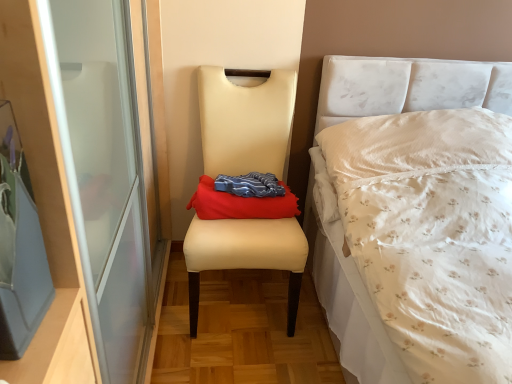
Question: From the image's perspective, is beige leather chair at center positioned above or below red fabric throw pillow at center?

Choices:
 (A) below
 (B) above

Answer: (A)

Question: Considering the positions of beige leather chair at center and red fabric throw pillow at center in the image, is beige leather chair at center bigger or smaller than red fabric throw pillow at center?

Choices:
 (A) small
 (B) big

Answer: (B)

Question: Does point (224, 170) appear closer or farther from the camera than point (271, 215)?

Choices:
 (A) closer
 (B) farther

Answer: (B)

Question: Based on their positions, is red fabric throw pillow at center located to the left or right of beige leather chair at center?

Choices:
 (A) left
 (B) right

Answer: (B)

Question: From the image's perspective, is red fabric throw pillow at center above or below beige leather chair at center?

Choices:
 (A) above
 (B) below

Answer: (A)

Question: Is red fabric throw pillow at center inside or outside of beige leather chair at center?

Choices:
 (A) inside
 (B) outside

Answer: (A)

Question: Does point (273, 203) appear closer or farther from the camera than point (224, 244)?

Choices:
 (A) closer
 (B) farther

Answer: (B)